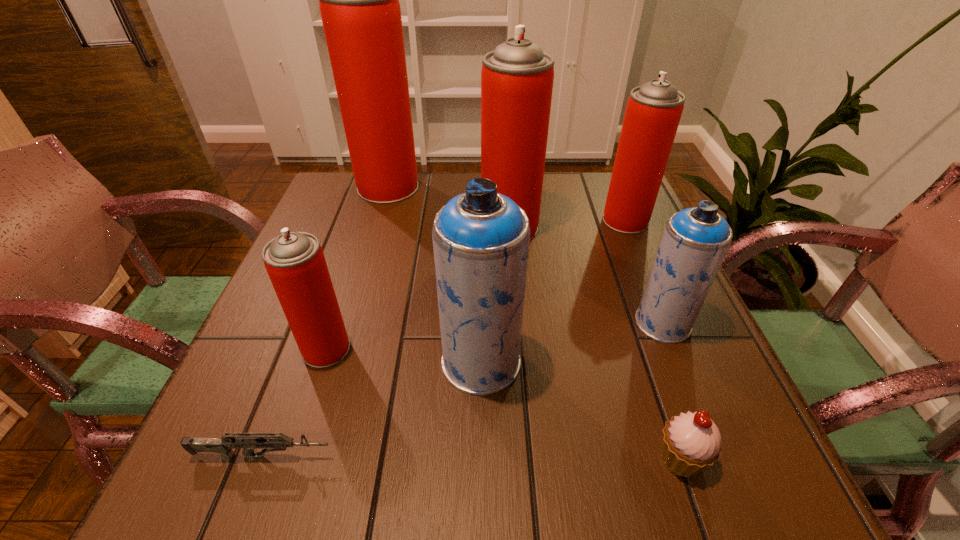
Identify the location of gun situated at the near edge. The height and width of the screenshot is (540, 960). (223, 445).

I want to click on gun present at the left edge, so click(223, 445).

This screenshot has width=960, height=540. I want to click on cupcake situated at the right edge, so click(x=691, y=442).

You are a GUI agent. You are given a task and a screenshot of the screen. Output one action in this format:
    pyautogui.click(x=<x>, y=<y>)
    Task: Click on the object that is at the far left corner
    The image size is (960, 540).
    Given the screenshot: What is the action you would take?
    pyautogui.click(x=359, y=4)

Identify the location of object that is at the near left corner. The width and height of the screenshot is (960, 540). (223, 445).

What are the coordinates of `object positioned at the far right corner` in the screenshot? It's located at (653, 112).

Image resolution: width=960 pixels, height=540 pixels. Find the location of `object that is at the near right corner`. object that is at the near right corner is located at coordinates (691, 442).

In the image, there is a desktop. Identify the location of free space at the far edge. (563, 188).

At what (x,y) coordinates should I click in order to perform the action: click on vacant space at the left edge. Please return your answer as a coordinate pair (x, y). Looking at the image, I should click on (368, 224).

Find the location of a particular element. The height and width of the screenshot is (540, 960). free space at the right edge is located at coordinates (600, 246).